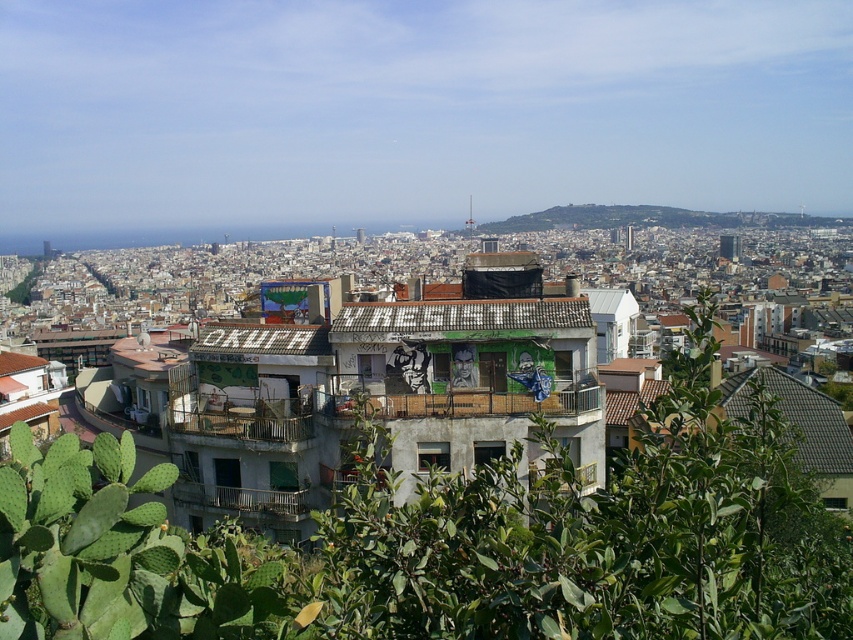
Question: Is green leafy plant at center further to the viewer compared to green grassy hillside at upper center?

Choices:
 (A) yes
 (B) no

Answer: (B)

Question: In this image, where is green leafy plant at center located relative to green grassy hillside at upper center?

Choices:
 (A) below
 (B) above

Answer: (A)

Question: Which object is closer to the camera taking this photo?

Choices:
 (A) green leafy plant at center
 (B) green grassy hillside at upper center

Answer: (A)

Question: Does green leafy plant at center have a lesser width compared to green grassy hillside at upper center?

Choices:
 (A) yes
 (B) no

Answer: (A)

Question: Which point is farther to the camera?

Choices:
 (A) green leafy plant at center
 (B) green grassy hillside at upper center

Answer: (B)